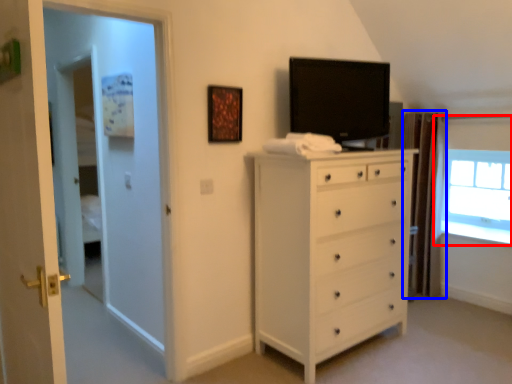
Question: Which object appears farthest to the camera in this image, window (highlighted by a red box) or curtain (highlighted by a blue box)?

Choices:
 (A) window
 (B) curtain

Answer: (A)